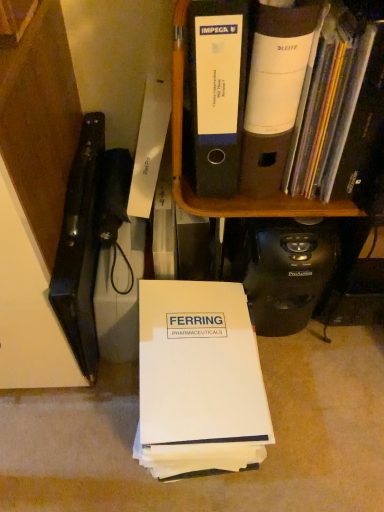
Question: Is the depth of white matte folder at upper right, which ranks as the first book in right-to-left order, less than that of white paper at center, the second book in the right-to-left sequence?

Choices:
 (A) no
 (B) yes

Answer: (B)

Question: Does white matte folder at upper right, the second book positioned from the left, have a larger size compared to white paper at center, which ranks as the 1th book in left-to-right order?

Choices:
 (A) yes
 (B) no

Answer: (B)

Question: Is the surface of white matte folder at upper right, the second book ordered from the bottom, in direct contact with white paper at center, the second book in the right-to-left sequence?

Choices:
 (A) yes
 (B) no

Answer: (B)

Question: Is white matte folder at upper right, the second book ordered from the bottom, aimed at white paper at center, which appears as the 1th book when ordered from the bottom?

Choices:
 (A) yes
 (B) no

Answer: (B)

Question: Considering the relative sizes of white matte folder at upper right, the second book positioned from the left, and white paper at center, which ranks as the 1th book in left-to-right order, in the image provided, is white matte folder at upper right, the second book positioned from the left, taller than white paper at center, which ranks as the 1th book in left-to-right order,?

Choices:
 (A) yes
 (B) no

Answer: (A)

Question: Is white matte folder at upper right, positioned as the first book in top-to-bottom order, inside or outside of black plastic file folders at upper center?

Choices:
 (A) outside
 (B) inside

Answer: (A)

Question: In terms of width, does white matte folder at upper right, the second book ordered from the bottom, look wider or thinner when compared to black plastic file folders at upper center?

Choices:
 (A) thin
 (B) wide

Answer: (A)

Question: Is point (327, 139) positioned closer to the camera than point (274, 195)?

Choices:
 (A) farther
 (B) closer

Answer: (B)

Question: Would you say white matte folder at upper right, positioned as the first book in top-to-bottom order, is to the left or to the right of black plastic file folders at upper center in the picture?

Choices:
 (A) right
 (B) left

Answer: (A)

Question: In terms of size, does white paper at center, which appears as the 2th book when viewed from the top, appear bigger or smaller than black plastic file folders at upper center?

Choices:
 (A) small
 (B) big

Answer: (B)

Question: Do you think white paper at center, which appears as the 1th book when ordered from the bottom, is within black plastic file folders at upper center, or outside of it?

Choices:
 (A) outside
 (B) inside

Answer: (A)

Question: Is white paper at center, which ranks as the 1th book in left-to-right order, wider or thinner than black plastic file folders at upper center?

Choices:
 (A) thin
 (B) wide

Answer: (B)

Question: From a real-world perspective, relative to black plastic file folders at upper center, is white paper at center, which appears as the 1th book when ordered from the bottom, vertically above or below?

Choices:
 (A) above
 (B) below

Answer: (B)

Question: From their relative heights in the image, would you say white paper at center, which appears as the 2th book when viewed from the top, is taller or shorter than white matte folder at upper right, the second book positioned from the left?

Choices:
 (A) tall
 (B) short

Answer: (B)

Question: Is point (230, 448) positioned closer to the camera than point (322, 138)?

Choices:
 (A) farther
 (B) closer

Answer: (A)